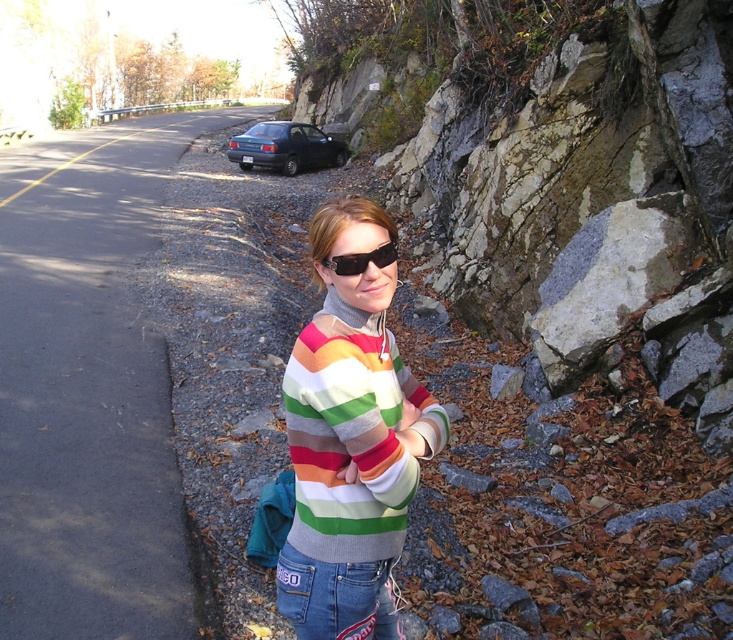
You are a photographer trying to capture the rainbow striped sweater at center and the black plastic sunglasses at center in a single shot. Which object should you focus on first to ensure both are in frame?

The rainbow striped sweater at center is much taller than the black plastic sunglasses at center, so focusing on the rainbow striped sweater at center first will help ensure both are in frame.